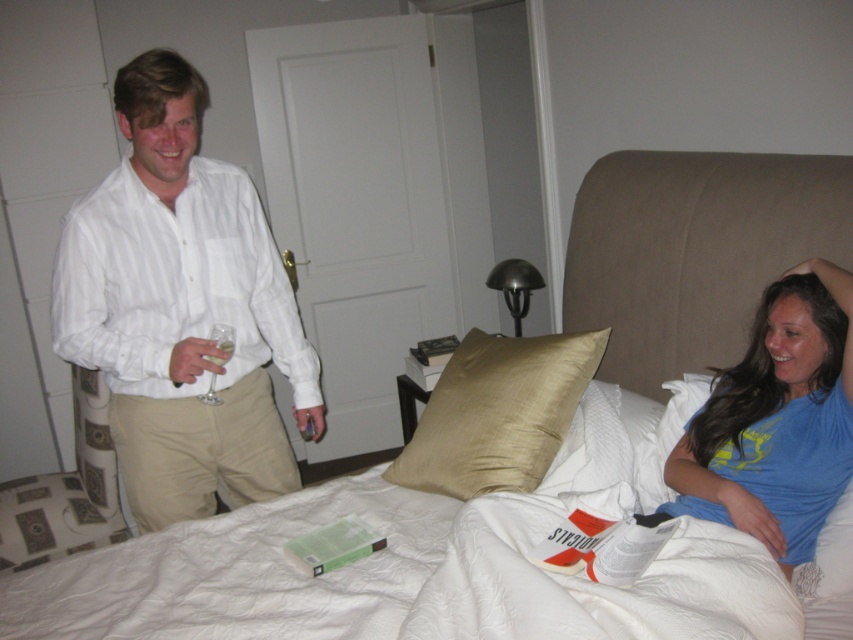
Question: From the image, what is the correct spatial relationship of blue cotton shirt at upper right in relation to silky gold pillow at center?

Choices:
 (A) left
 (B) right

Answer: (B)

Question: Is blue cotton shirt at upper right below silky gold pillow at center?

Choices:
 (A) yes
 (B) no

Answer: (B)

Question: Which point is closer to the camera taking this photo?

Choices:
 (A) (155, 509)
 (B) (426, 410)
 (C) (161, 161)

Answer: (C)

Question: Estimate the real-world distances between objects in this image. Which object is closer to the white striped shirt at left?

Choices:
 (A) blue cotton shirt at upper right
 (B) silky gold pillow at center
 (C) khaki cotton pants at left

Answer: (C)

Question: Is white striped shirt at left above khaki cotton pants at left?

Choices:
 (A) yes
 (B) no

Answer: (A)

Question: Estimate the real-world distances between objects in this image. Which object is closer to the blue cotton shirt at upper right?

Choices:
 (A) silky gold pillow at center
 (B) khaki cotton pants at left
 (C) white striped shirt at left

Answer: (A)